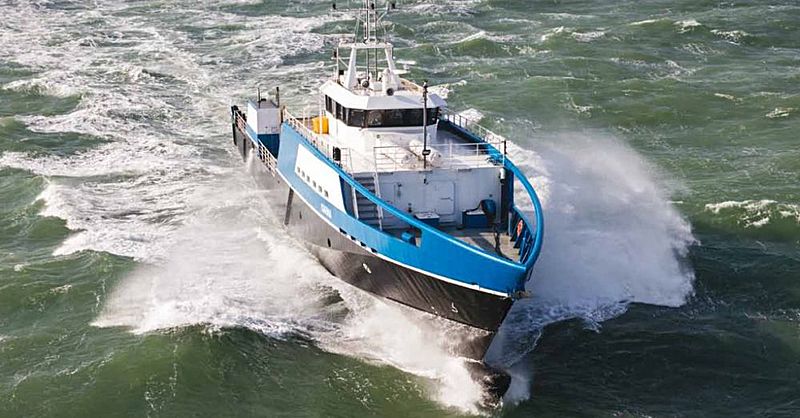
Identify the location of blue paint. (450, 258).